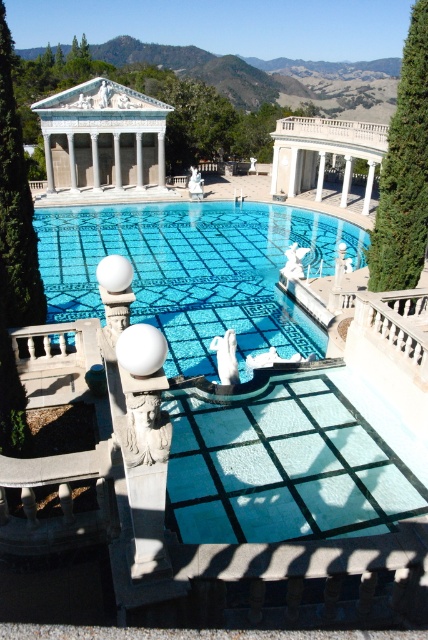
Question: Which point is farther to the camera?

Choices:
 (A) white marble balustrade at upper right
 (B) blue glass mosaic at center
 (C) green leafy cypress tree at upper right
 (D) white marble gazebo at upper center

Answer: (D)

Question: Observing the image, what is the correct spatial positioning of white marble gazebo at upper center in reference to green leafy cypress tree at left?

Choices:
 (A) left
 (B) right

Answer: (A)

Question: Does white marble gazebo at upper center appear over white marble balustrade at upper right?

Choices:
 (A) no
 (B) yes

Answer: (B)

Question: Which object is positioned closest to the green leafy cypress tree at upper right?

Choices:
 (A) blue glass mosaic at center
 (B) white marble gazebo at upper center
 (C) green leafy cypress tree at left
 (D) white marble balustrade at upper right

Answer: (D)

Question: Which point is closer to the camera taking this photo?

Choices:
 (A) (421, 96)
 (B) (98, 77)
 (C) (350, 225)

Answer: (A)

Question: Can you confirm if green leafy cypress tree at left is thinner than white marble balustrade at upper right?

Choices:
 (A) no
 (B) yes

Answer: (B)